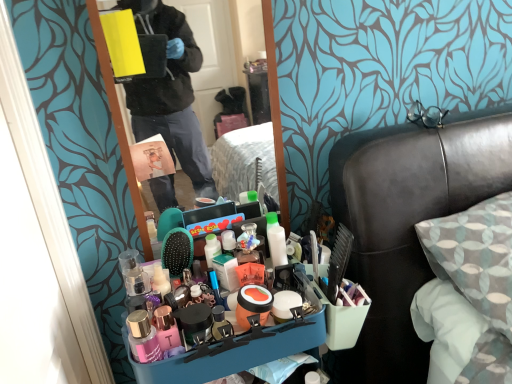
Question: Can you confirm if black leather headboard at upper right is shorter than clear plastic mirror at center?

Choices:
 (A) no
 (B) yes

Answer: (A)

Question: Can you confirm if black leather headboard at upper right is taller than clear plastic mirror at center?

Choices:
 (A) yes
 (B) no

Answer: (A)

Question: Can you confirm if black leather headboard at upper right is wider than clear plastic mirror at center?

Choices:
 (A) yes
 (B) no

Answer: (A)

Question: Does black leather headboard at upper right have a smaller size compared to clear plastic mirror at center?

Choices:
 (A) no
 (B) yes

Answer: (A)

Question: From the image's perspective, is black leather headboard at upper right on clear plastic mirror at center?

Choices:
 (A) yes
 (B) no

Answer: (B)

Question: Is blue plastic tray at center inside or outside of clear plastic mirror at center?

Choices:
 (A) inside
 (B) outside

Answer: (B)

Question: Is blue plastic tray at center bigger or smaller than clear plastic mirror at center?

Choices:
 (A) big
 (B) small

Answer: (A)

Question: Based on their positions, is blue plastic tray at center located to the left or right of clear plastic mirror at center?

Choices:
 (A) left
 (B) right

Answer: (B)

Question: From the image's perspective, is blue plastic tray at center positioned above or below clear plastic mirror at center?

Choices:
 (A) below
 (B) above

Answer: (A)

Question: In terms of width, does yellow matte box at upper left look wider or thinner when compared to black leather headboard at upper right?

Choices:
 (A) thin
 (B) wide

Answer: (A)

Question: Is yellow matte box at upper left inside the boundaries of black leather headboard at upper right, or outside?

Choices:
 (A) outside
 (B) inside

Answer: (A)

Question: Considering the positions of yellow matte box at upper left and black leather headboard at upper right in the image, is yellow matte box at upper left bigger or smaller than black leather headboard at upper right?

Choices:
 (A) big
 (B) small

Answer: (B)

Question: Does point (138, 62) appear closer or farther from the camera than point (415, 339)?

Choices:
 (A) closer
 (B) farther

Answer: (A)

Question: Is clear plastic mirror at center taller or shorter than matte pink book at center?

Choices:
 (A) short
 (B) tall

Answer: (B)

Question: In terms of width, does clear plastic mirror at center look wider or thinner when compared to matte pink book at center?

Choices:
 (A) thin
 (B) wide

Answer: (B)